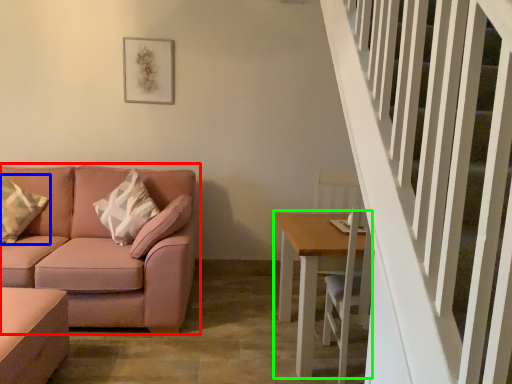
Question: Estimate the real-world distances between objects in this image. Which object is closer to studio couch (highlighted by a red box), pillow (highlighted by a blue box) or table (highlighted by a green box)?

Choices:
 (A) pillow
 (B) table

Answer: (A)